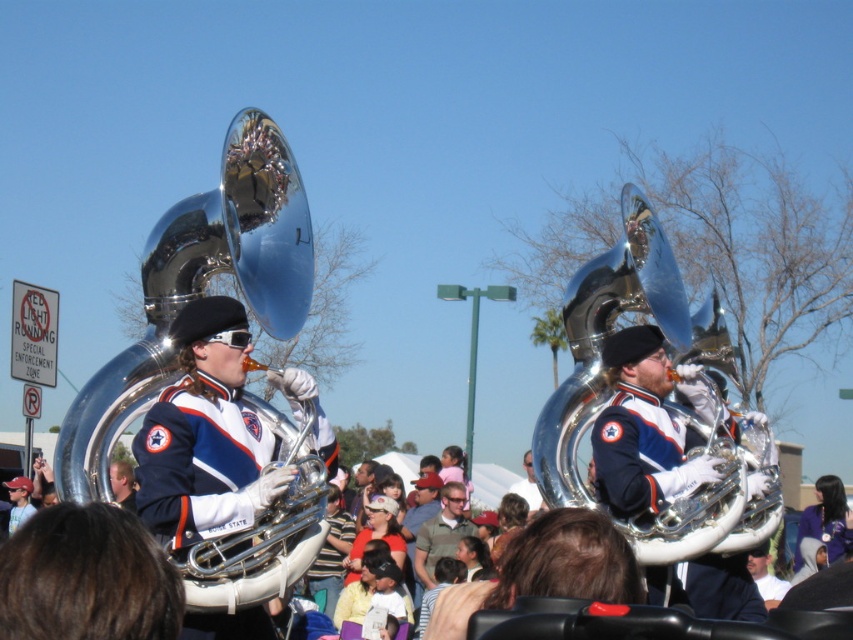
Question: Which point is farther to the camera?

Choices:
 (A) blue wool jacket at center
 (B) blue uniform at center

Answer: (B)

Question: Which object appears closest to the camera in this image?

Choices:
 (A) blue wool jacket at center
 (B) polished silver tuba at left
 (C) blue uniform at center

Answer: (A)

Question: Is polished silver tuba at left positioned at the back of blue uniform at center?

Choices:
 (A) no
 (B) yes

Answer: (A)

Question: Where is polished silver tuba at center located in relation to matte blue uniform at center in the image?

Choices:
 (A) above
 (B) below

Answer: (A)

Question: Which object appears farthest from the camera in this image?

Choices:
 (A) blue wool jacket at center
 (B) polished silver tuba at left

Answer: (B)

Question: Can you confirm if polished silver tuba at left is thinner than blue wool jacket at center?

Choices:
 (A) yes
 (B) no

Answer: (B)